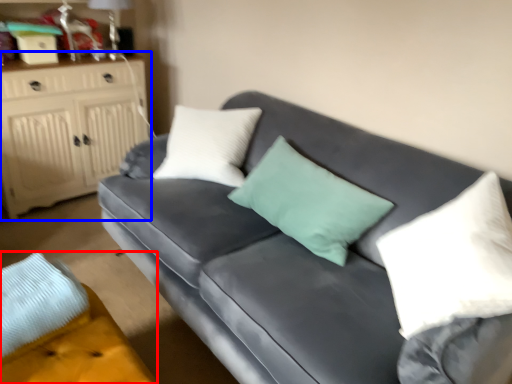
Question: Among these objects, which one is farthest to the camera, footrest (highlighted by a red box) or cabinetry (highlighted by a blue box)?

Choices:
 (A) footrest
 (B) cabinetry

Answer: (B)